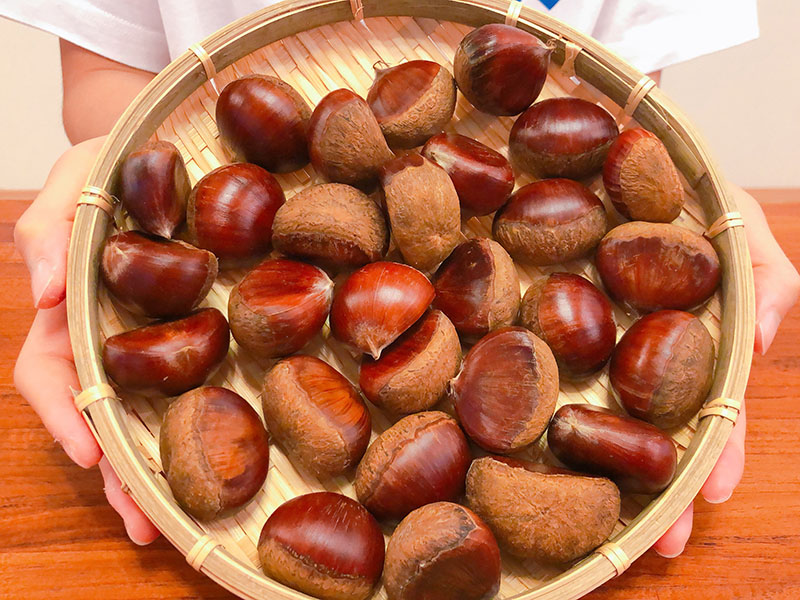
Locate an element on the screen. This screenshot has width=800, height=600. wall is located at coordinates click(46, 79), click(749, 96).